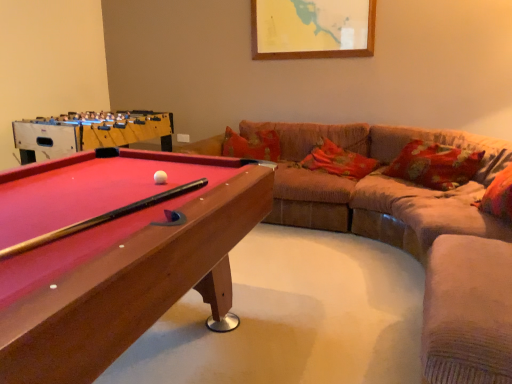
Question: Would you say wooden billiard table at left is to the left or to the right of floral fabric pillow at center, the third pillow in the front-to-back sequence, in the picture?

Choices:
 (A) left
 (B) right

Answer: (A)

Question: In the image, is wooden billiard table at left positioned in front of or behind floral fabric pillow at center, the third pillow in the front-to-back sequence?

Choices:
 (A) behind
 (B) front

Answer: (B)

Question: Which object is the farthest from the floral fabric pillow at right, the 2th pillow positioned from the back?

Choices:
 (A) floral fabric pillow at center, the third pillow in the front-to-back sequence
 (B) velvet beige couch at right
 (C) suede-like beige swivel chair at lower right
 (D) fluffy fabric pillow at right, the third pillow in the back-to-front sequence
 (E) smooth wood pool table at left

Answer: (E)

Question: Estimate the real-world distances between objects in this image. Which object is closer to the wooden billiard table at left?

Choices:
 (A) smooth wood pool table at left
 (B) fluffy fabric pillow at right, which is the 1th pillow from front to back
 (C) velvet beige couch at right
 (D) floral fabric pillow at right, positioned as the 2th pillow in front-to-back order
 (E) suede-like beige swivel chair at lower right

Answer: (E)